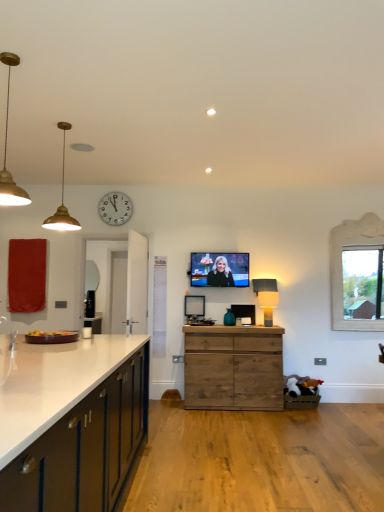
You are a GUI agent. You are given a task and a screenshot of the screen. Output one action in this format:
    pyautogui.click(x=<x>, y=<y>)
    Task: Click on the vacant space situated above white carved wood window at right (from a real-world perspective)
    
    Given the screenshot: What is the action you would take?
    pyautogui.click(x=362, y=212)